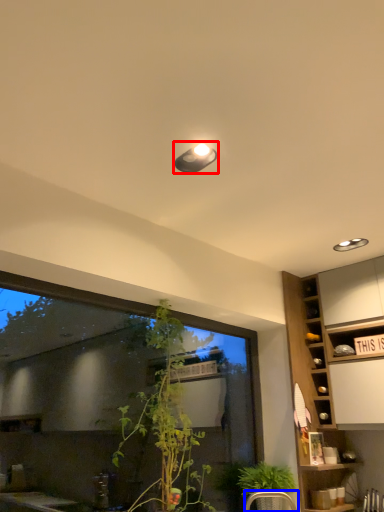
Question: Which point is closer to the camera, light fixture (highlighted by a red box) or armchair (highlighted by a blue box)?

Choices:
 (A) light fixture
 (B) armchair

Answer: (A)